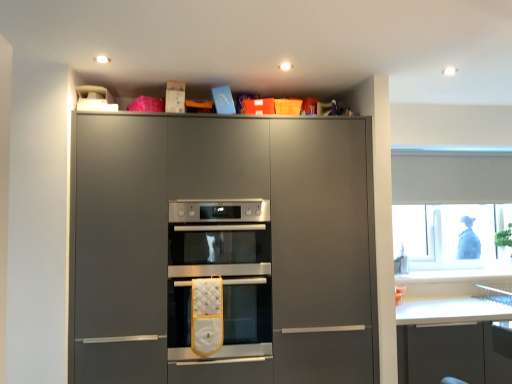
Where is `satin silver oven at center, placed as the 1th oven when sorted from top to bottom`? The width and height of the screenshot is (512, 384). satin silver oven at center, placed as the 1th oven when sorted from top to bottom is located at coordinates (220, 234).

Where is `white quilted oven mitt at center, which is the first oven from bottom to top`? white quilted oven mitt at center, which is the first oven from bottom to top is located at coordinates (247, 311).

Does point (169, 198) appear closer or farther from the camera than point (253, 337)?

Point (169, 198).

Between matte gray oven at center and white quilted oven mitt at center, the second oven viewed from the top, which one is positioned behind?

white quilted oven mitt at center, the second oven viewed from the top, is further from the camera.

In terms of width, does matte gray oven at center look wider or thinner when compared to white quilted oven mitt at center, the second oven viewed from the top?

In the image, matte gray oven at center appears to be more narrow than white quilted oven mitt at center, the second oven viewed from the top.

Is matte gray oven at center not inside white quilted oven mitt at center, the second oven viewed from the top?

Yes, matte gray oven at center is located beyond the bounds of white quilted oven mitt at center, the second oven viewed from the top.

Are satin silver oven at center, which ranks as the second oven in bottom-to-top order, and matte gray oven at center far apart?

No, satin silver oven at center, which ranks as the second oven in bottom-to-top order, is not far away from matte gray oven at center.

Does point (186, 204) appear closer or farther from the camera than point (301, 244)?

Point (186, 204).

From the picture: From a real-world perspective, is satin silver oven at center, which ranks as the second oven in bottom-to-top order, positioned under matte gray oven at center based on gravity?

No, from a real-world perspective, satin silver oven at center, which ranks as the second oven in bottom-to-top order, is not beneath matte gray oven at center.

Is satin silver oven at center, which ranks as the second oven in bottom-to-top order, oriented away from matte gray oven at center?

Yes, satin silver oven at center, which ranks as the second oven in bottom-to-top order,'s orientation is away from matte gray oven at center.

Considering their positions, is matte gray oven at center located in front of or behind transparent plastic window at upper right?

matte gray oven at center is positioned closer to the viewer than transparent plastic window at upper right.

Are matte gray oven at center and transparent plastic window at upper right far apart?

Yes, matte gray oven at center is far from transparent plastic window at upper right.

Can we say matte gray oven at center lies outside transparent plastic window at upper right?

That's correct, matte gray oven at center is outside of transparent plastic window at upper right.

From the image's perspective, does matte gray oven at center appear lower than transparent plastic window at upper right?

Correct, matte gray oven at center appears lower than transparent plastic window at upper right in the image.

From a real-world perspective, between white quilted oven mitt at center, which is the first oven from bottom to top, and transparent plastic window at upper right, who is vertically higher?

transparent plastic window at upper right, from a real-world perspective.

From the image's perspective, is white quilted oven mitt at center, the second oven viewed from the top, located above or below transparent plastic window at upper right?

From the image's perspective, white quilted oven mitt at center, the second oven viewed from the top, appears below transparent plastic window at upper right.

Does white quilted oven mitt at center, which is the first oven from bottom to top, have a greater height compared to transparent plastic window at upper right?

No.

Is white quilted oven mitt at center, which is the first oven from bottom to top, positioned with its back to transparent plastic window at upper right?

No.

Is satin silver oven at center, placed as the 1th oven when sorted from top to bottom, next to white quilted oven mitt at center, the second oven viewed from the top?

No, satin silver oven at center, placed as the 1th oven when sorted from top to bottom, is not beside white quilted oven mitt at center, the second oven viewed from the top.

Is satin silver oven at center, placed as the 1th oven when sorted from top to bottom, in front of or behind white quilted oven mitt at center, the second oven viewed from the top, in the image?

Clearly, satin silver oven at center, placed as the 1th oven when sorted from top to bottom, is behind white quilted oven mitt at center, the second oven viewed from the top.

Is satin silver oven at center, which ranks as the second oven in bottom-to-top order, thinner than white quilted oven mitt at center, the second oven viewed from the top?

Yes, satin silver oven at center, which ranks as the second oven in bottom-to-top order, is thinner than white quilted oven mitt at center, the second oven viewed from the top.

From the image's perspective, would you say transparent plastic window at upper right is shown under satin silver oven at center, which ranks as the second oven in bottom-to-top order?

No, from the image's perspective, transparent plastic window at upper right is not beneath satin silver oven at center, which ranks as the second oven in bottom-to-top order.

Which object is further away from the camera, transparent plastic window at upper right or satin silver oven at center, which ranks as the second oven in bottom-to-top order?

transparent plastic window at upper right is further away from the camera.

Are transparent plastic window at upper right and satin silver oven at center, placed as the 1th oven when sorted from top to bottom, beside each other?

No, transparent plastic window at upper right is not making contact with satin silver oven at center, placed as the 1th oven when sorted from top to bottom.

Which is correct: transparent plastic window at upper right is inside satin silver oven at center, which ranks as the second oven in bottom-to-top order, or outside of it?

The correct answer is: outside.

From a real-world perspective, which object stands above the other?

satin silver oven at center, which ranks as the second oven in bottom-to-top order, is physically above.

Considering the positions of objects matte gray oven at center and satin silver oven at center, placed as the 1th oven when sorted from top to bottom, in the image provided, who is more to the right, matte gray oven at center or satin silver oven at center, placed as the 1th oven when sorted from top to bottom,?

From the viewer's perspective, matte gray oven at center appears more on the right side.

From the image's perspective, is matte gray oven at center positioned above or below satin silver oven at center, placed as the 1th oven when sorted from top to bottom?

matte gray oven at center is below satin silver oven at center, placed as the 1th oven when sorted from top to bottom.

Considering the sizes of matte gray oven at center and satin silver oven at center, which ranks as the second oven in bottom-to-top order, in the image, is matte gray oven at center taller or shorter than satin silver oven at center, which ranks as the second oven in bottom-to-top order,?

In the image, matte gray oven at center appears to be taller than satin silver oven at center, which ranks as the second oven in bottom-to-top order.

Image resolution: width=512 pixels, height=384 pixels. I want to click on cabinetry that is on the right side of white quilted oven mitt at center, the second oven viewed from the top, so click(224, 248).

Identify the location of cabinetry below the satin silver oven at center, which ranks as the second oven in bottom-to-top order (from the image's perspective). This screenshot has width=512, height=384. (224, 248).

From the image, which object appears to be nearer to matte gray oven at center, white quilted oven mitt at center, the second oven viewed from the top, or satin silver oven at center, placed as the 1th oven when sorted from top to bottom?

satin silver oven at center, placed as the 1th oven when sorted from top to bottom, is positioned closer to the anchor matte gray oven at center.

From the image, which object appears to be farther from white quilted oven mitt at center, the second oven viewed from the top, matte gray oven at center or satin silver oven at center, which ranks as the second oven in bottom-to-top order?

matte gray oven at center.

Based on their spatial positions, is satin silver oven at center, which ranks as the second oven in bottom-to-top order, or white quilted oven mitt at center, which is the first oven from bottom to top, further from matte gray oven at center?

white quilted oven mitt at center, which is the first oven from bottom to top, is further to matte gray oven at center.

In the scene shown: Based on their spatial positions, is satin silver oven at center, which ranks as the second oven in bottom-to-top order, or matte gray oven at center closer to transparent plastic window at upper right?

matte gray oven at center.

From the image, which object appears to be nearer to white quilted oven mitt at center, which is the first oven from bottom to top, satin silver oven at center, which ranks as the second oven in bottom-to-top order, or transparent plastic window at upper right?

The object closer to white quilted oven mitt at center, which is the first oven from bottom to top, is satin silver oven at center, which ranks as the second oven in bottom-to-top order.

Looking at the image, which one is located further to transparent plastic window at upper right, white quilted oven mitt at center, the second oven viewed from the top, or satin silver oven at center, which ranks as the second oven in bottom-to-top order?

Among the two, satin silver oven at center, which ranks as the second oven in bottom-to-top order, is located further to transparent plastic window at upper right.

From the image, which object appears to be farther from satin silver oven at center, which ranks as the second oven in bottom-to-top order, white quilted oven mitt at center, the second oven viewed from the top, or matte gray oven at center?

The object further to satin silver oven at center, which ranks as the second oven in bottom-to-top order, is white quilted oven mitt at center, the second oven viewed from the top.

Looking at this image, considering their positions, is transparent plastic window at upper right positioned closer to satin silver oven at center, which ranks as the second oven in bottom-to-top order, than matte gray oven at center?

matte gray oven at center lies closer to satin silver oven at center, which ranks as the second oven in bottom-to-top order, than the other object.

Image resolution: width=512 pixels, height=384 pixels. In order to click on cabinetry between satin silver oven at center, which ranks as the second oven in bottom-to-top order, and white quilted oven mitt at center, the second oven viewed from the top, from top to bottom in this screenshot , I will do `click(224, 248)`.

At what (x,y) coordinates should I click in order to perform the action: click on cabinetry located between satin silver oven at center, placed as the 1th oven when sorted from top to bottom, and transparent plastic window at upper right in the left-right direction. Please return your answer as a coordinate pair (x, y). Looking at the image, I should click on (224, 248).

This screenshot has width=512, height=384. I want to click on cabinetry between white quilted oven mitt at center, which is the first oven from bottom to top, and transparent plastic window at upper right from left to right, so click(x=224, y=248).

The width and height of the screenshot is (512, 384). I want to click on oven between satin silver oven at center, placed as the 1th oven when sorted from top to bottom, and transparent plastic window at upper right, so click(247, 311).